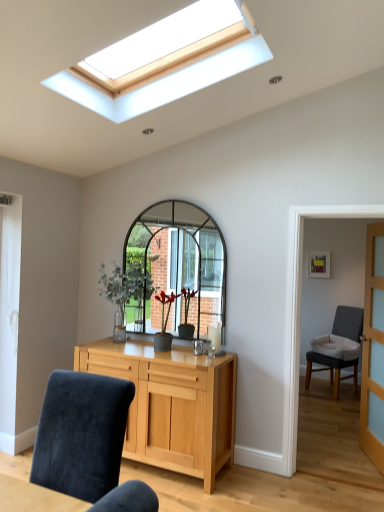
At what (x,y) coordinates should I click in order to perform the action: click on vacant space behind matte gray vase at center. Please return your answer as a coordinate pair (x, y). This screenshot has width=384, height=512. Looking at the image, I should click on (161, 347).